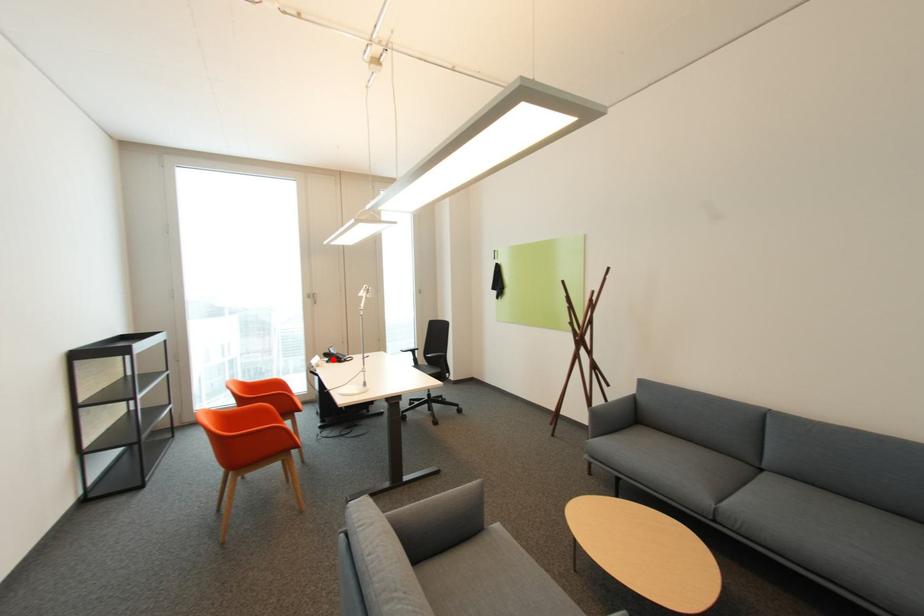
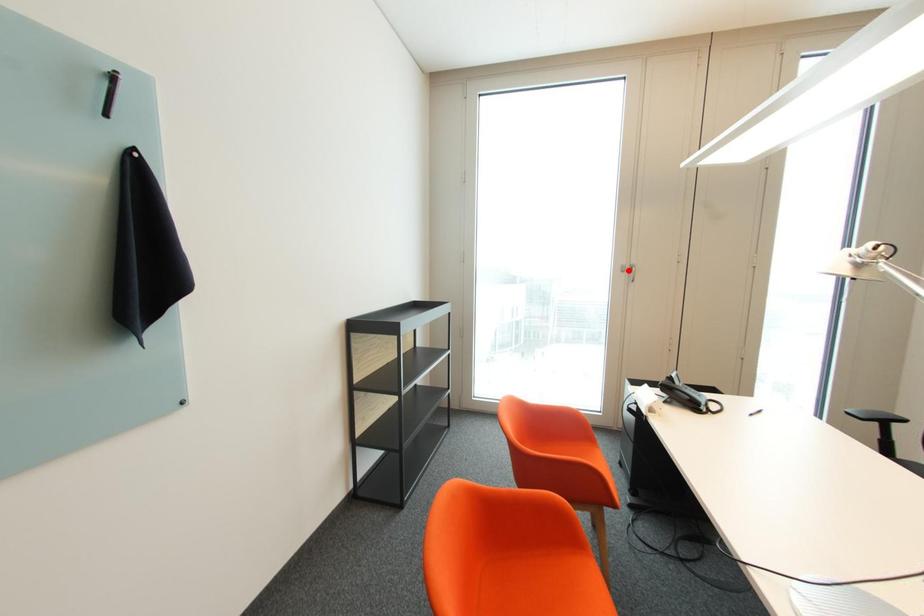
I am providing you with two images of the same scene from different viewpoints. A red point is marked on the first image and another point is marked on the second image. Do the highlighted points in image1 and image2 indicate the same real-world spot?

No